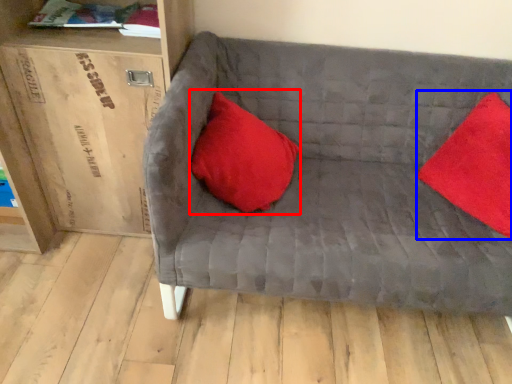
Question: Among these objects, which one is nearest to the camera, pillow (highlighted by a red box) or pillow (highlighted by a blue box)?

Choices:
 (A) pillow
 (B) pillow

Answer: (B)